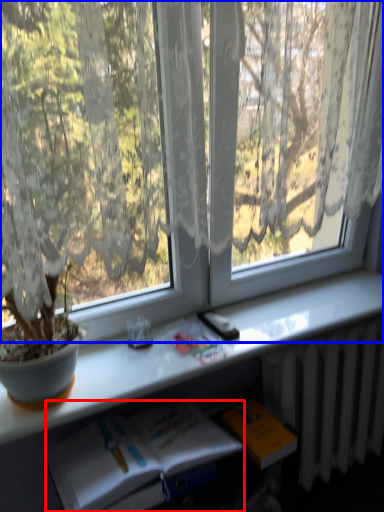
Question: Which point is closer to the camera, book (highlighted by a red box) or window (highlighted by a blue box)?

Choices:
 (A) book
 (B) window

Answer: (B)